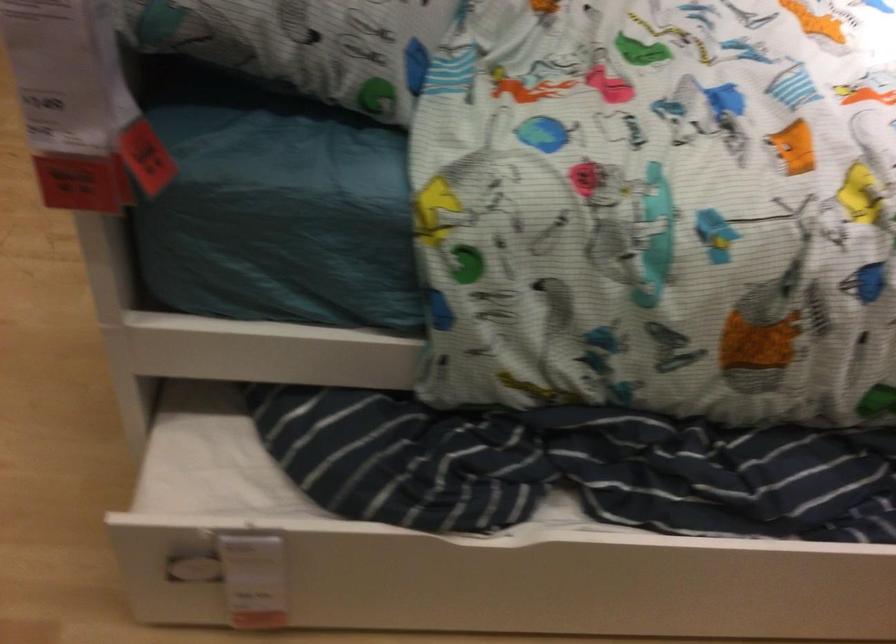
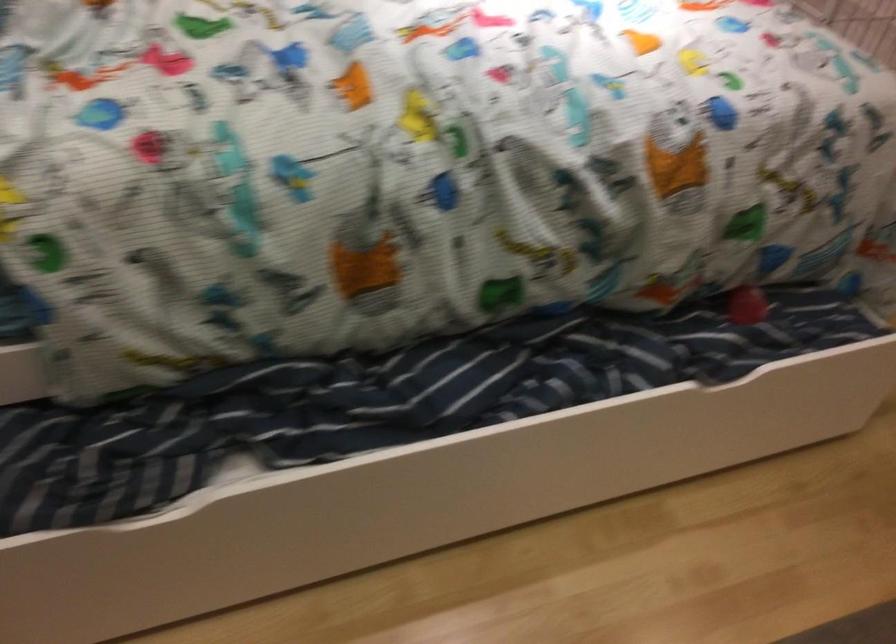
Question: The first image is from the beginning of the video and the second image is from the end. How did the camera likely rotate when shooting the video?

Choices:
 (A) Left
 (B) Right
 (C) Up
 (D) Down

Answer: (B)